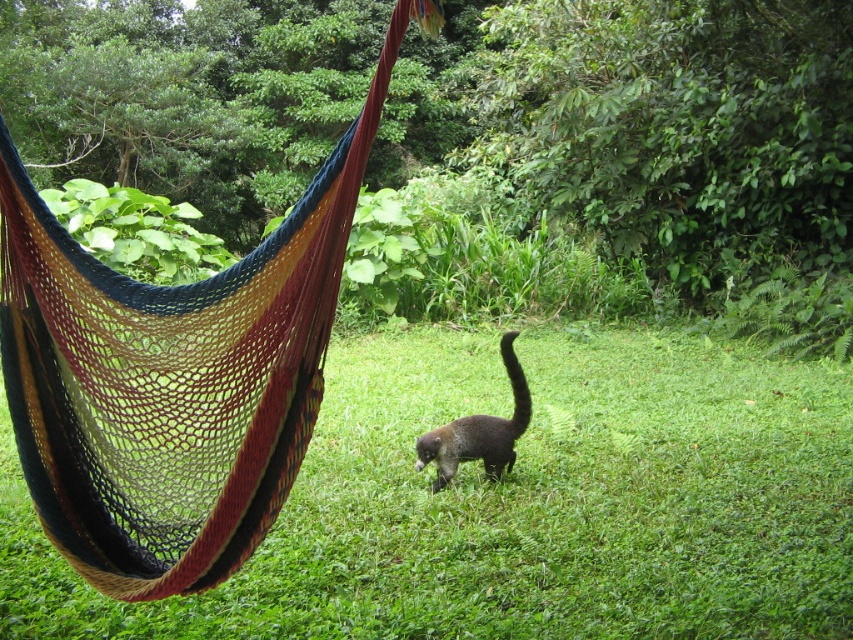
In the scene shown: Which is more to the right, multicolored woven hammock at center or brown fuzzy tail at center?

From the viewer's perspective, brown fuzzy tail at center appears more on the right side.

Does point (355, 200) come farther from viewer compared to point (512, 353)?

That is False.

Locate an element on the screen. multicolored woven hammock at center is located at coordinates (172, 376).

Which of these two, green grass at center or brown fuzzy tail at center, stands taller?

With more height is brown fuzzy tail at center.

Does point (287, 509) lie in front of point (515, 372)?

Yes, point (287, 509) is in front of point (515, 372).

Who is more distant from viewer, (x=373, y=634) or (x=512, y=380)?

The point (x=512, y=380) is more distant.

In order to click on green grass at center in this screenshot , I will do `click(521, 502)`.

Which is behind, point (730, 561) or point (450, 472)?

The point (450, 472) is more distant.

Is green grass at center bigger than brown furry cat at center?

Actually, green grass at center might be smaller than brown furry cat at center.

Locate an element on the screen. This screenshot has width=853, height=640. green grass at center is located at coordinates (521, 502).

Where is `green grass at center`? green grass at center is located at coordinates (521, 502).